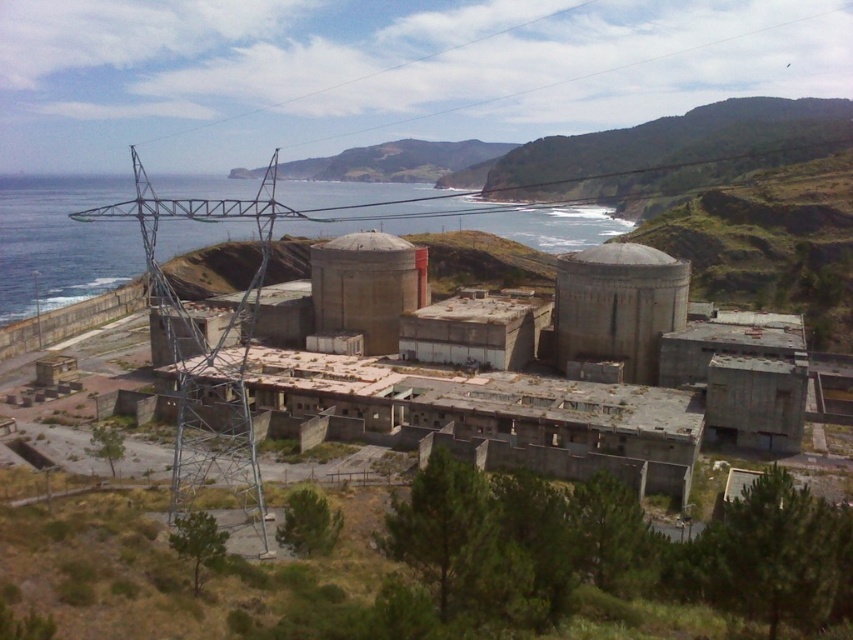
Where is `blue water at center`? blue water at center is located at coordinates (61, 243).

Can you confirm if blue water at center is bigger than green grassy hillside at upper center?

Indeed, blue water at center has a larger size compared to green grassy hillside at upper center.

Image resolution: width=853 pixels, height=640 pixels. What do you see at coordinates (61, 243) in the screenshot? I see `blue water at center` at bounding box center [61, 243].

Where is `blue water at center`? This screenshot has width=853, height=640. blue water at center is located at coordinates (61, 243).

Is point (630, 372) in front of point (334, 257)?

That is True.

Which is below, concrete dome at center-right or concrete silo at center?

concrete dome at center-right is below.

Who is more distant from viewer, (x=593, y=291) or (x=337, y=252)?

The point (x=337, y=252) is behind.

What are the coordinates of `concrete dome at center-right` in the screenshot? It's located at (618, 307).

This screenshot has width=853, height=640. In order to click on concrete dome at center-right in this screenshot , I will do `click(618, 307)`.

Does point (674, 275) come farther from viewer compared to point (463, 154)?

No, (674, 275) is in front of (463, 154).

Identify the location of concrete dome at center-right. pyautogui.click(x=618, y=307).